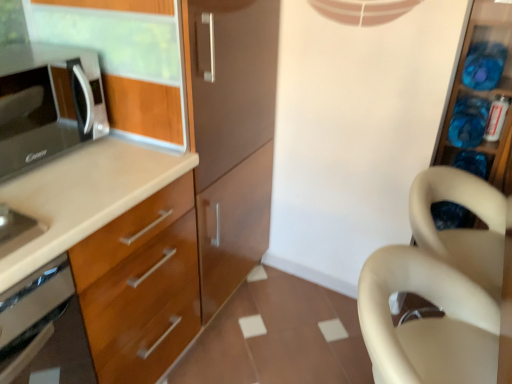
Question: From the image's perspective, relative to translucent plastic containers at right, is beige plastic swivel chair at right above or below?

Choices:
 (A) above
 (B) below

Answer: (B)

Question: Does point (428, 370) appear closer or farther from the camera than point (501, 132)?

Choices:
 (A) closer
 (B) farther

Answer: (A)

Question: Which of these objects is positioned farthest from the beige matte chair at right?

Choices:
 (A) matte black microwave at left
 (B) translucent plastic containers at right
 (C) satin silver oven at lower left
 (D) beige plastic swivel chair at right

Answer: (A)

Question: Which object is positioned closest to the beige plastic swivel chair at right?

Choices:
 (A) translucent plastic containers at right
 (B) matte black microwave at left
 (C) satin silver oven at lower left
 (D) beige matte chair at right

Answer: (D)